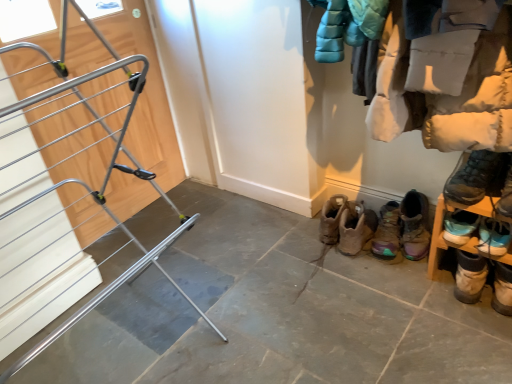
This screenshot has height=384, width=512. I want to click on free space to the left of camouflage fabric boot at lower center, which is counted as the 5th footwear, starting from the right, so pos(342,267).